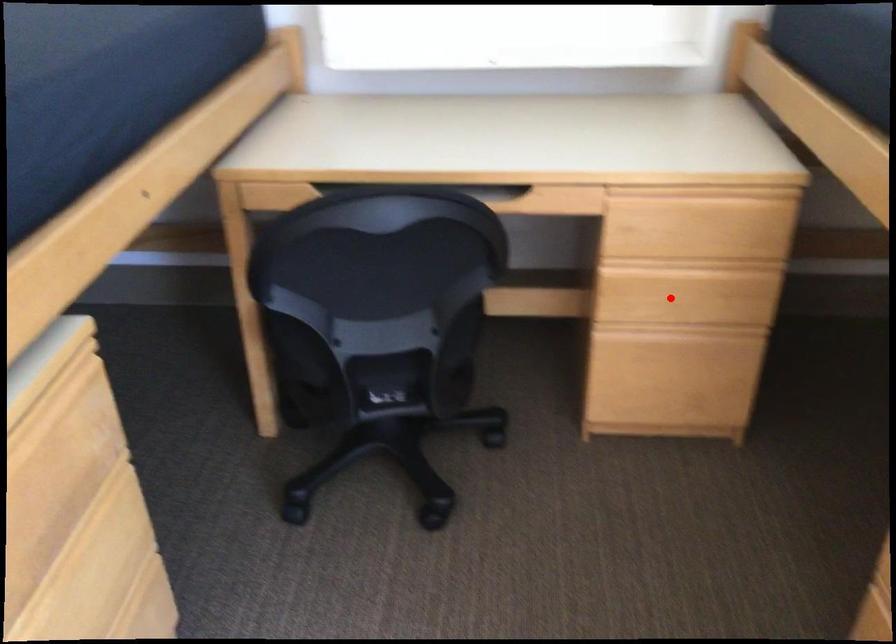
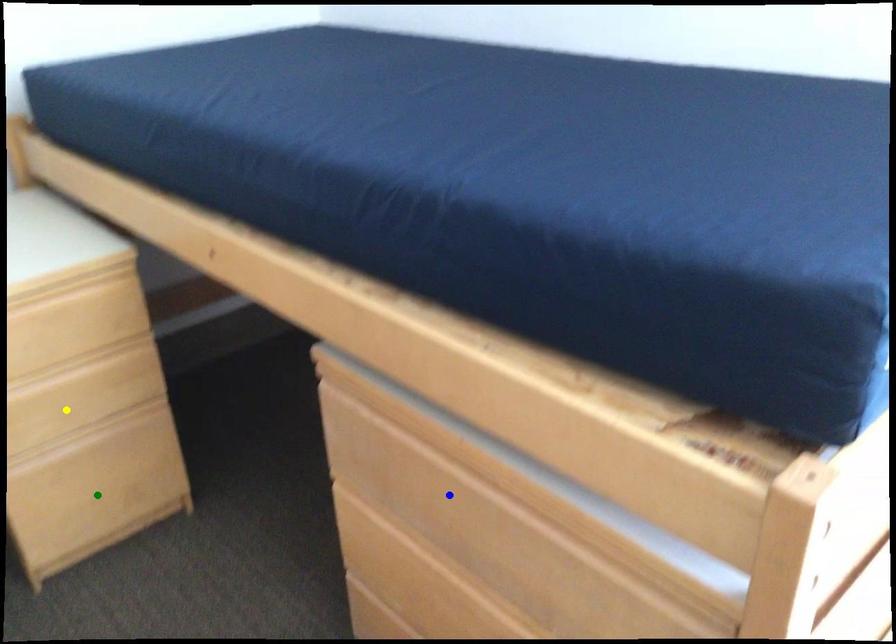
Question: I am providing you with two images of the same scene from different viewpoints. A red point is marked on the first image. You are given multiple points on the second image. Which point in image 2 represents the same 3d spot as the red point in image 1?

Choices:
 (A) yellow point
 (B) blue point
 (C) green point

Answer: (A)